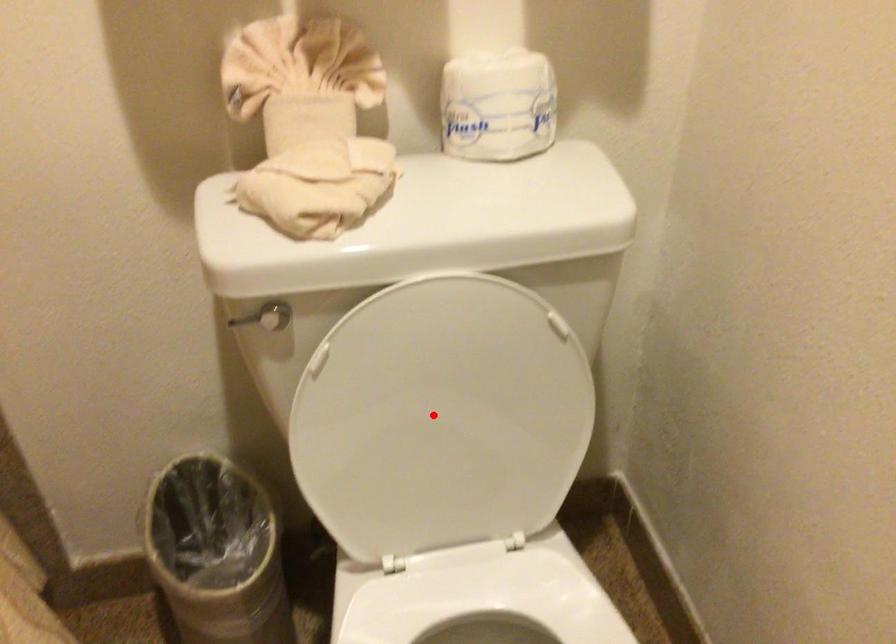
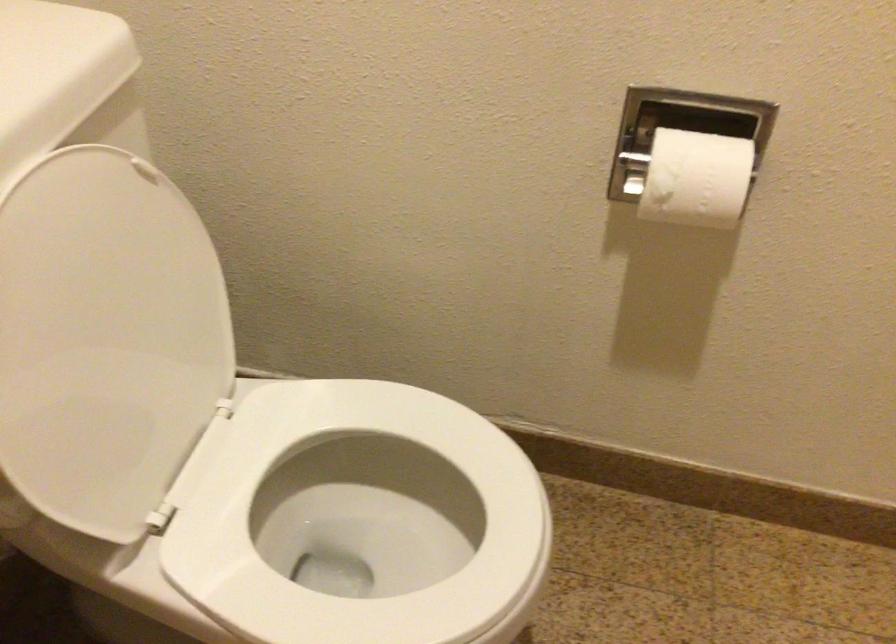
Find the pixel in the second image that matches the highlighted location in the first image.

(105, 339)